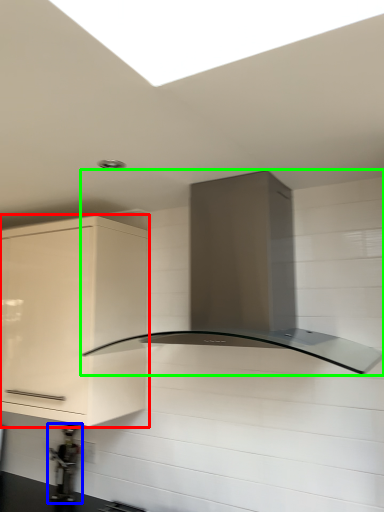
Question: Which object is positioned farthest from cabinetry (highlighted by a red box)? Select from appliance (highlighted by a blue box) and home appliance (highlighted by a green box).

Choices:
 (A) appliance
 (B) home appliance

Answer: (A)